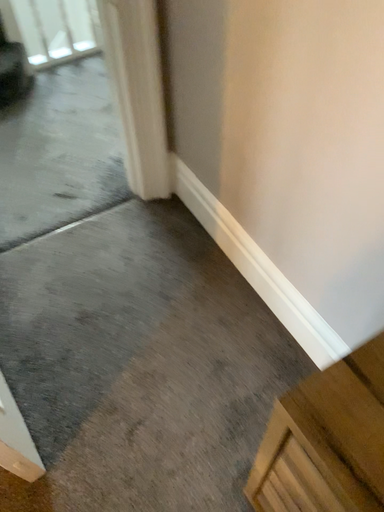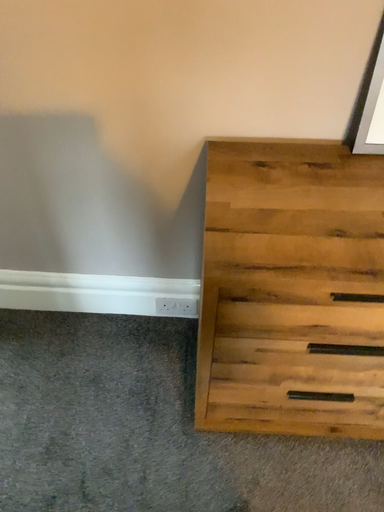
Question: How did the camera likely rotate when shooting the video?

Choices:
 (A) rotated upward
 (B) rotated downward

Answer: (A)